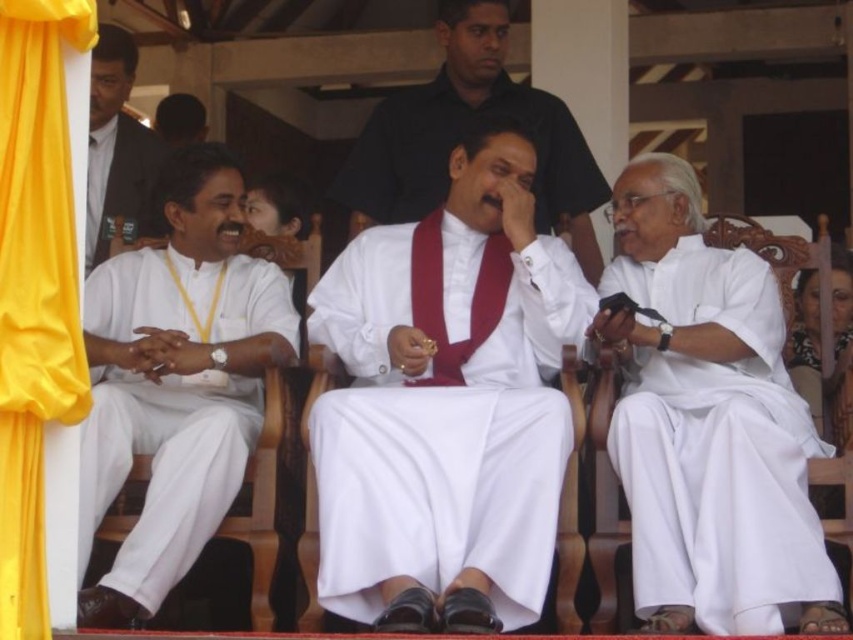
This screenshot has width=853, height=640. What do you see at coordinates (457, 134) in the screenshot?
I see `white silk shirt at center` at bounding box center [457, 134].

Can you confirm if white silk shirt at center is positioned below white fabric suit at left?

Incorrect, white silk shirt at center is not positioned below white fabric suit at left.

I want to click on white silk shirt at center, so click(x=457, y=134).

Where is `white silk shirt at center`? This screenshot has width=853, height=640. white silk shirt at center is located at coordinates (457, 134).

Is white silk robe at center wider than yellow fabric curtain at left?

Yes.

Who is shorter, white silk robe at center or yellow fabric curtain at left?

With less height is white silk robe at center.

At what (x,y) coordinates should I click in order to perform the action: click on white silk robe at center. Please return your answer as a coordinate pair (x, y). The image size is (853, 640). Looking at the image, I should click on (440, 433).

Can you confirm if white cotton shirt at left is bigger than white silk shirt at center?

No.

Looking at this image, is white cotton shirt at left smaller than white silk shirt at center?

Yes, white cotton shirt at left is smaller than white silk shirt at center.

Locate an element on the screen. This screenshot has width=853, height=640. white cotton shirt at left is located at coordinates (177, 381).

You are a GUI agent. You are given a task and a screenshot of the screen. Output one action in this format:
    pyautogui.click(x=<x>, y=<y>)
    Task: Click on the white cotton shirt at left
    Image resolution: width=853 pixels, height=640 pixels.
    Given the screenshot: What is the action you would take?
    click(x=177, y=381)